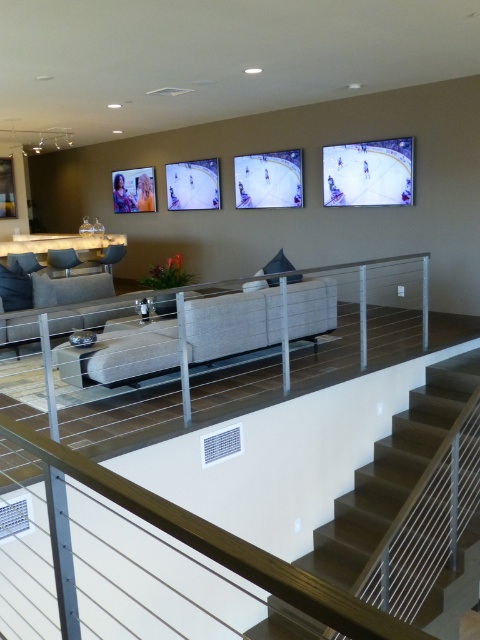
You are planning to rearrange the furniture in the living space. You want to place a new coffee table between the dark brown wooden stairs at center and the light gray fabric couch at center. Given their widths, which object should the coffee table be closer to?

The coffee table should be placed closer to the dark brown wooden stairs at center because it has a lesser width compared to the light gray fabric couch at center, meaning the stairs take up less space and the couch is wider.

You are standing on the second floor of the house and want to go down to the lounge area. There is a dark brown wooden stairs at center and a light gray fabric couch at center in your way. Which object should you avoid stepping on to reach the lounge area safely?

You should avoid stepping on the light gray fabric couch at center because the dark brown wooden stairs at center is located below it, leading down to the lounge area.

Based on the photo, you are planning to rearrange the living space and want to place a new coffee table between the dark brown wooden stairs at center and the light gray fabric couch at center. Given that the coffee table is 1.5 meters wide, can it fit in the space between them?

The dark brown wooden stairs at center is bigger than the light gray fabric couch at center, but the exact distance between them isn